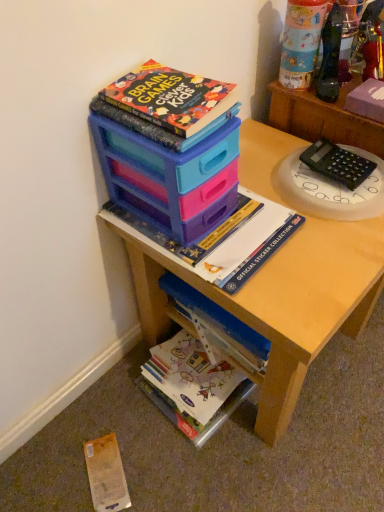
Locate an element on the screen. Image resolution: width=384 pixels, height=512 pixels. vacant area on top of wooden desk at center (from a real-world perspective) is located at coordinates click(x=295, y=209).